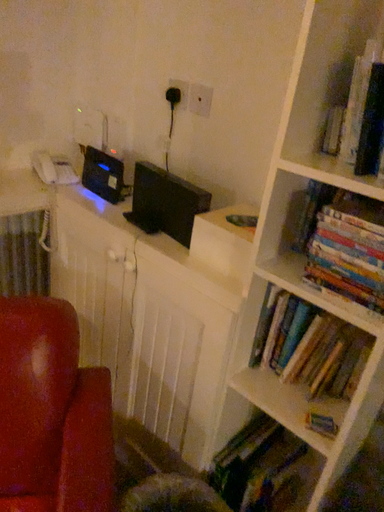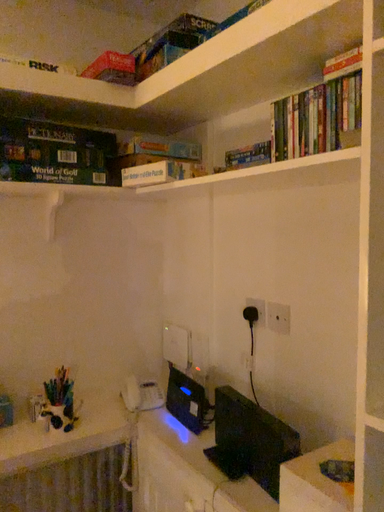
Question: How did the camera likely rotate when shooting the video?

Choices:
 (A) rotated right
 (B) rotated left

Answer: (B)